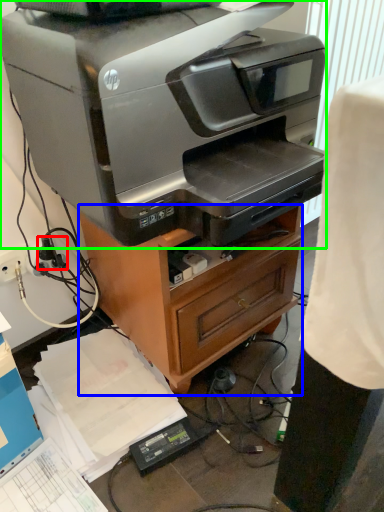
Question: Which object is the closest to the plug (highlighted by a red box)? Choose among these: furniture (highlighted by a blue box) or printer (highlighted by a green box).

Choices:
 (A) furniture
 (B) printer

Answer: (A)